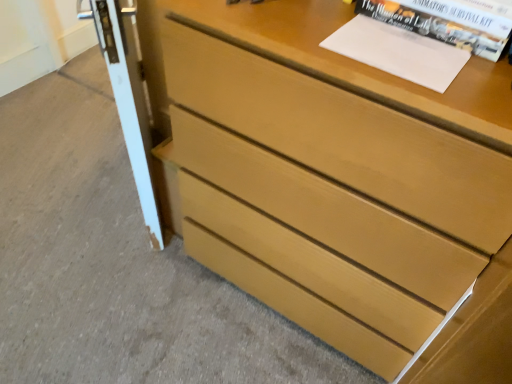
Locate an element on the screen. vacant area on top of white paper at upper right (from a real-world perspective) is located at coordinates (395, 43).